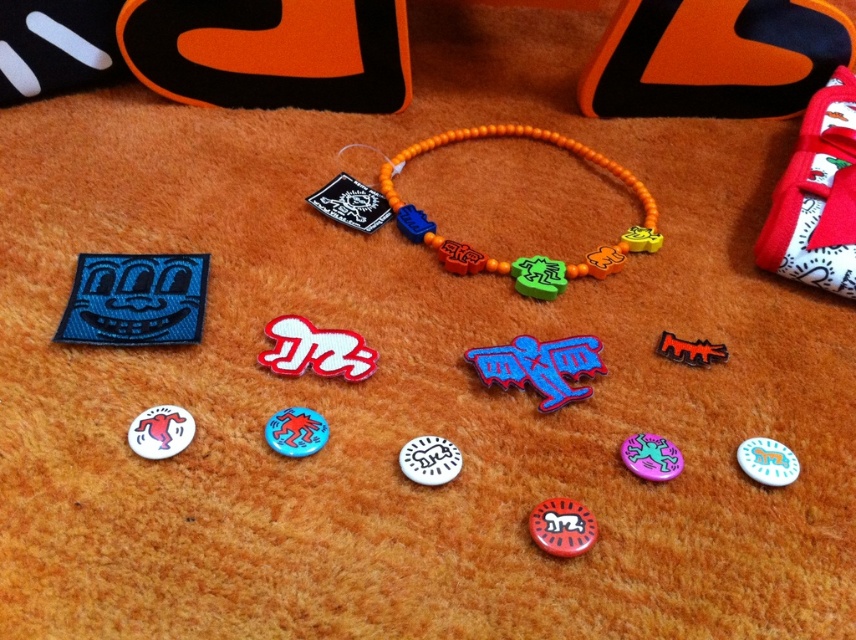
You are organizing a craft fair and have a display area with limited space. You need to place both the white glossy badge at lower left and the white matte badge at center. Since space is tight, you want to know which badge requires more space. Which one takes up more space?

The white glossy badge at lower left is bigger than the white matte badge at center, so it requires more space.

You are standing in front of a display of colorful items on an orange surface. You see a velvet fabric toy at upper right. If you want to pick it up, will you need to move closer than 5 feet?

The velvet fabric toy at upper right is 4.94 feet away from the viewer, so yes, you need to move closer than 5 feet to pick it up.